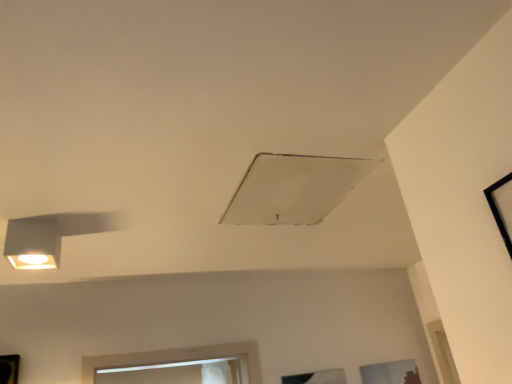
Image resolution: width=512 pixels, height=384 pixels. I want to click on black frame at upper right, which is the 3th window in bottom-to-top order, so click(x=499, y=209).

Measure the distance between black frame at upper right, which is the 1th window in top-to-bottom order, and camera.

A distance of 38.11 inches exists between black frame at upper right, which is the 1th window in top-to-bottom order, and camera.

Describe the element at coordinates (294, 188) in the screenshot. This screenshot has width=512, height=384. I see `white matte exhaust hood at center` at that location.

How much space does transparent glass window at lower right, the 1th window positioned from the bottom, occupy horizontally?

transparent glass window at lower right, the 1th window positioned from the bottom, is 0.70 inches wide.

Where is `matte white lamp at left`? Image resolution: width=512 pixels, height=384 pixels. matte white lamp at left is located at coordinates (33, 244).

Describe the element at coordinates (317, 377) in the screenshot. I see `transparent glass window at lower center, acting as the 2th window starting from the bottom` at that location.

This screenshot has height=384, width=512. What are the coordinates of `black frame at upper right, the second window positioned from the left` in the screenshot? It's located at (499, 209).

From the image's perspective, is transparent glass window at lower center, which is the first window in left-to-right order, on white matte exhaust hood at center?

No, from the image's perspective, transparent glass window at lower center, which is the first window in left-to-right order, is not above white matte exhaust hood at center.

Locate an element on the screen. The width and height of the screenshot is (512, 384). window that is the 1st one when counting rightward from the white matte exhaust hood at center is located at coordinates (317, 377).

Is transparent glass window at lower center, which is the first window in left-to-right order, far away from white matte exhaust hood at center?

Yes.

Is transparent glass window at lower center, acting as the 2th window starting from the bottom, positioned with its back to white matte exhaust hood at center?

No, transparent glass window at lower center, acting as the 2th window starting from the bottom,'s orientation is not away from white matte exhaust hood at center.

Does point (7, 229) lie behind point (273, 198)?

No, it is in front of (273, 198).

What's the angular difference between matte white lamp at left and white matte exhaust hood at center's facing directions?

0.564 degrees separate the facing orientations of matte white lamp at left and white matte exhaust hood at center.

Considering the relative sizes of matte white lamp at left and white matte exhaust hood at center in the image provided, is matte white lamp at left taller than white matte exhaust hood at center?

Yes.

What's the angular difference between transparent glass window at lower right, which appears as the third window when viewed from the left, and white matte exhaust hood at center's facing directions?

89.9 degrees.

Based on their positions, is transparent glass window at lower right, the 1th window positioned from the bottom, located to the left or right of white matte exhaust hood at center?

Clearly, transparent glass window at lower right, the 1th window positioned from the bottom, is on the right of white matte exhaust hood at center in the image.

How much distance is there between transparent glass window at lower right, the 1th window viewed from the back, and white matte exhaust hood at center?

They are 4.96 feet apart.

From the image's perspective, which is above, transparent glass window at lower right, which appears as the third window when viewed from the left, or white matte exhaust hood at center?

white matte exhaust hood at center, from the image's perspective.

Is point (407, 367) farther from viewer compared to point (32, 249)?

Yes, it is behind point (32, 249).

Do you think transparent glass window at lower right, the third window when ordered from front to back, is within matte white lamp at left, or outside of it?

The correct answer is: outside.

From a real-world perspective, is transparent glass window at lower right, the 1th window positioned from the bottom, on top of matte white lamp at left?

Actually, transparent glass window at lower right, the 1th window positioned from the bottom, is physically below matte white lamp at left in the real world.

Which of these two, transparent glass window at lower right, the 1th window positioned from the bottom, or transparent glass window at lower center, which is the first window in left-to-right order, stands taller?

transparent glass window at lower center, which is the first window in left-to-right order, is taller.

From a real-world perspective, does transparent glass window at lower right, the third window viewed from the top, stand above transparent glass window at lower center, placed as the second window when sorted from front to back?

Incorrect, from a real-world perspective, transparent glass window at lower right, the third window viewed from the top, is lower than transparent glass window at lower center, placed as the second window when sorted from front to back.

Is transparent glass window at lower right, the third window viewed from the top, placed right next to transparent glass window at lower center, which ranks as the 2th window in top-to-bottom order?

No, transparent glass window at lower right, the third window viewed from the top, is not making contact with transparent glass window at lower center, which ranks as the 2th window in top-to-bottom order.

Considering the sizes of black frame at upper right, which is the 1th window in top-to-bottom order, and transparent glass window at lower right, marked as the 1th window in a right-to-left arrangement, in the image, is black frame at upper right, which is the 1th window in top-to-bottom order, bigger or smaller than transparent glass window at lower right, marked as the 1th window in a right-to-left arrangement,?

Considering their sizes, black frame at upper right, which is the 1th window in top-to-bottom order, takes up more space than transparent glass window at lower right, marked as the 1th window in a right-to-left arrangement.

Can you confirm if black frame at upper right, marked as the 2th window in a right-to-left arrangement, is shorter than transparent glass window at lower right, the third window viewed from the top?

In fact, black frame at upper right, marked as the 2th window in a right-to-left arrangement, may be taller than transparent glass window at lower right, the third window viewed from the top.

Based on the photo, does black frame at upper right, which is the 3th window in bottom-to-top order, come in front of transparent glass window at lower right, the 1th window viewed from the back?

Yes, black frame at upper right, which is the 3th window in bottom-to-top order, is in front of transparent glass window at lower right, the 1th window viewed from the back.

Between point (263, 185) and point (388, 375), which one is positioned behind?

The point (388, 375) is more distant.

Between white matte exhaust hood at center and transparent glass window at lower right, which appears as the third window when viewed from the left, which one has more height?

Standing taller between the two is transparent glass window at lower right, which appears as the third window when viewed from the left.

Can you confirm if white matte exhaust hood at center is thinner than transparent glass window at lower right, the third window when ordered from front to back?

No, white matte exhaust hood at center is not thinner than transparent glass window at lower right, the third window when ordered from front to back.

Find the location of a particular element. The width and height of the screenshot is (512, 384). exhaust hood to the left of transparent glass window at lower center, which ranks as the 3th window in right-to-left order is located at coordinates (294, 188).

This screenshot has width=512, height=384. Identify the location of exhaust hood in front of the matte white lamp at left. (294, 188).

From the image, which object appears to be farther from white matte exhaust hood at center, black frame at upper right, the 1th window from the front, or matte white lamp at left?

matte white lamp at left is positioned further to the anchor white matte exhaust hood at center.

Considering their positions, is transparent glass window at lower center, which is the first window in left-to-right order, positioned closer to matte white lamp at left than black frame at upper right, which is the 1th window in top-to-bottom order?

Among the two, black frame at upper right, which is the 1th window in top-to-bottom order, is located nearer to matte white lamp at left.

Considering their positions, is transparent glass window at lower center, the second window from the back, positioned further to transparent glass window at lower right, the 1th window positioned from the bottom, than matte white lamp at left?

Among the two, matte white lamp at left is located further to transparent glass window at lower right, the 1th window positioned from the bottom.

Which object lies nearer to the anchor point white matte exhaust hood at center, transparent glass window at lower center, which is the first window in left-to-right order, or matte white lamp at left?

matte white lamp at left is closer to white matte exhaust hood at center.

Based on their spatial positions, is matte white lamp at left or white matte exhaust hood at center closer to black frame at upper right, which is the 3th window in bottom-to-top order?

Based on the image, white matte exhaust hood at center appears to be nearer to black frame at upper right, which is the 3th window in bottom-to-top order.

When comparing their distances from white matte exhaust hood at center, does matte white lamp at left or black frame at upper right, marked as the 2th window in a right-to-left arrangement, seem further?

The object further to white matte exhaust hood at center is matte white lamp at left.

Considering their positions, is matte white lamp at left positioned closer to transparent glass window at lower right, the third window viewed from the top, than black frame at upper right, which is the 3th window in bottom-to-top order?

black frame at upper right, which is the 3th window in bottom-to-top order.

Looking at the image, which one is located further to black frame at upper right, the 3th window in the back-to-front sequence, transparent glass window at lower center, which ranks as the 2th window in top-to-bottom order, or transparent glass window at lower right, marked as the 1th window in a right-to-left arrangement?

transparent glass window at lower right, marked as the 1th window in a right-to-left arrangement.

Image resolution: width=512 pixels, height=384 pixels. I want to click on window between black frame at upper right, which is the 3th window in bottom-to-top order, and transparent glass window at lower right, the third window when ordered from front to back, from front to back, so click(x=317, y=377).

In order to click on exhaust hood between matte white lamp at left and transparent glass window at lower center, which ranks as the 2th window in top-to-bottom order, in the horizontal direction in this screenshot , I will do `click(294, 188)`.

I want to click on lamp between black frame at upper right, marked as the 2th window in a right-to-left arrangement, and transparent glass window at lower right, the 1th window viewed from the back, from front to back, so click(x=33, y=244).

Where is `exhaust hood between black frame at upper right, the 3th window in the back-to-front sequence, and transparent glass window at lower right, the 1th window viewed from the back, along the z-axis`? The height and width of the screenshot is (384, 512). exhaust hood between black frame at upper right, the 3th window in the back-to-front sequence, and transparent glass window at lower right, the 1th window viewed from the back, along the z-axis is located at coordinates (294, 188).